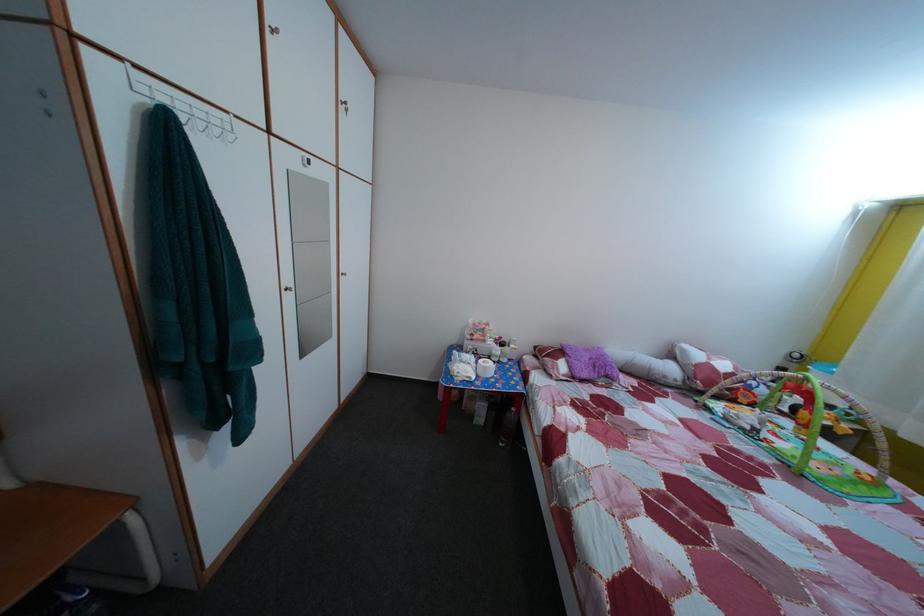
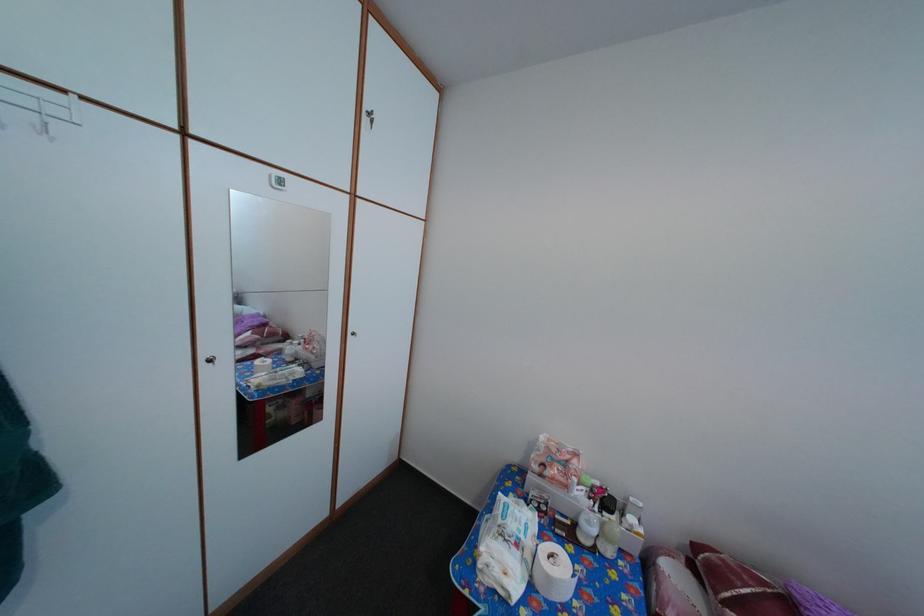
The point at (544, 355) is marked in the first image. Where is the corresponding point in the second image?

(704, 554)